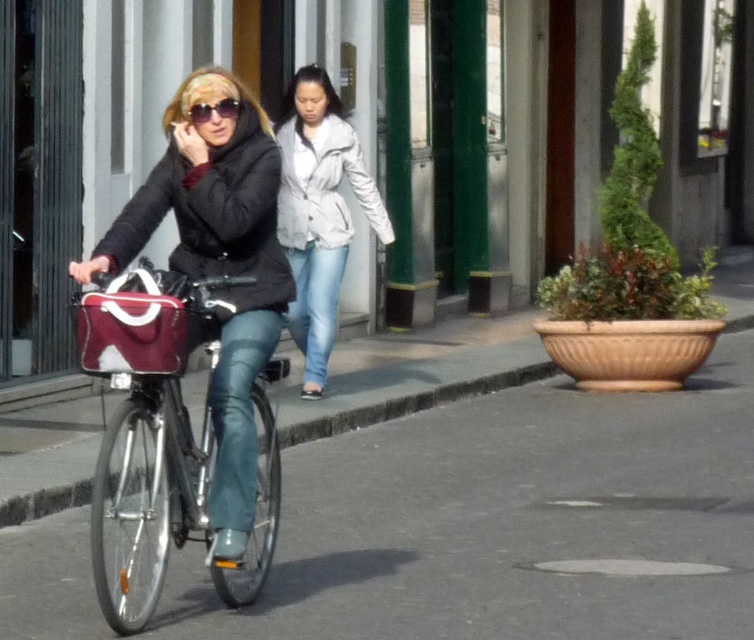
A delivery robot needs to travel from the light gray textured jacket at center to the maroon fabric bag at left. Can it make the journey if its maximum travel distance is 5 meters?

The distance between the light gray textured jacket at center and the maroon fabric bag at left is 5.13 meters, which exceeds the robot maximum travel distance of 5 meters. The robot cannot make the journey.

You are a pedestrian trying to cross the street. You see the woman on the bicycle and notice the maroon fabric bag at left and the matte black sunglasses at upper center. Which object is closer to the left side of the image?

The maroon fabric bag at left is closer to the left side of the image than the matte black sunglasses at upper center.

You are a delivery person who needs to place a package on the sidewalk between the light gray textured jacket at center and the maroon fabric bag at left. Since the package requires 1.2 meters of space, can you fit it there?

The light gray textured jacket at center is wider than the maroon fabric bag at left, but the description does not provide the exact distance between them. Therefore, it is uncertain if the 1.2 meters of space needed for the package is available.